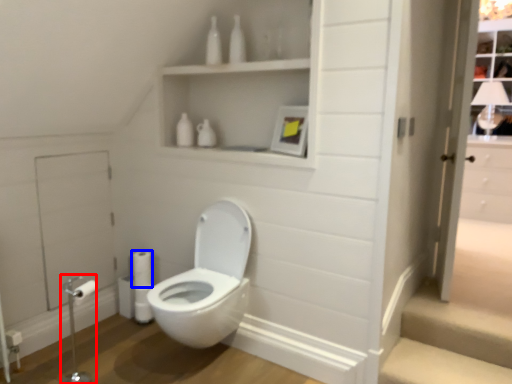
Question: Which of the following is the farthest to the observer, towel bar (highlighted by a red box) or toilet paper (highlighted by a blue box)?

Choices:
 (A) towel bar
 (B) toilet paper

Answer: (B)